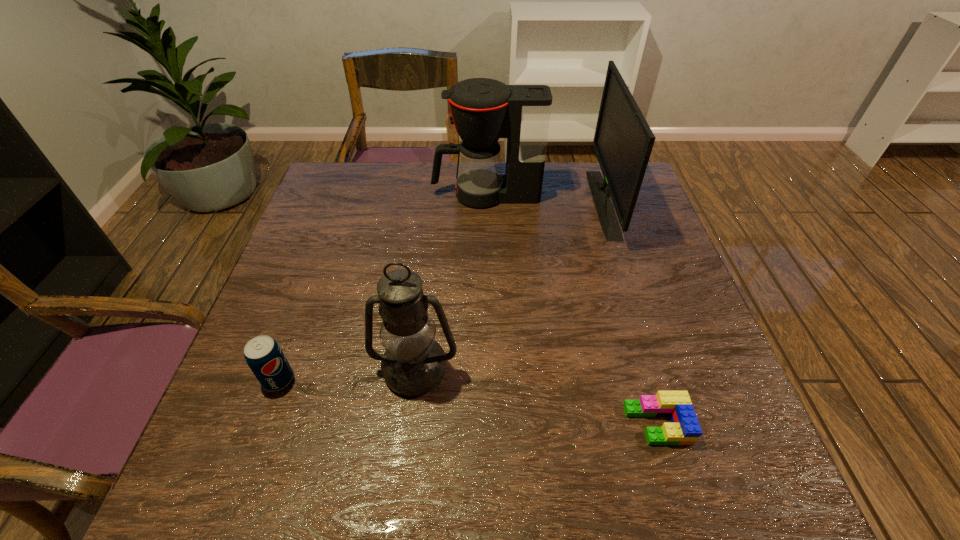
This screenshot has width=960, height=540. I want to click on monitor, so click(623, 141).

This screenshot has width=960, height=540. In order to click on coffee maker in this screenshot , I will do `click(483, 110)`.

You are a GUI agent. You are given a task and a screenshot of the screen. Output one action in this format:
    pyautogui.click(x=<x>, y=<y>)
    Task: Click on the oil lamp
    
    Given the screenshot: What is the action you would take?
    pyautogui.click(x=413, y=364)

Locate an element on the screen. the leftmost object is located at coordinates (264, 356).

Locate an element on the screen. This screenshot has width=960, height=540. pop is located at coordinates (264, 356).

The width and height of the screenshot is (960, 540). I want to click on Lego, so click(x=684, y=429).

Locate an element on the screen. Image resolution: width=960 pixels, height=540 pixels. the nearest object is located at coordinates (684, 429).

I want to click on free space located on the front-facing side of the monitor, so click(x=550, y=203).

You are a GUI agent. You are given a task and a screenshot of the screen. Output one action in this format:
    pyautogui.click(x=<x>, y=<y>)
    Task: Click on the vacant space located on the front-facing side of the monitor
    This screenshot has height=540, width=960.
    Given the screenshot: What is the action you would take?
    pyautogui.click(x=468, y=203)

Where is `free space located 0.120m on the front-facing side of the monitor`? Image resolution: width=960 pixels, height=540 pixels. free space located 0.120m on the front-facing side of the monitor is located at coordinates (553, 203).